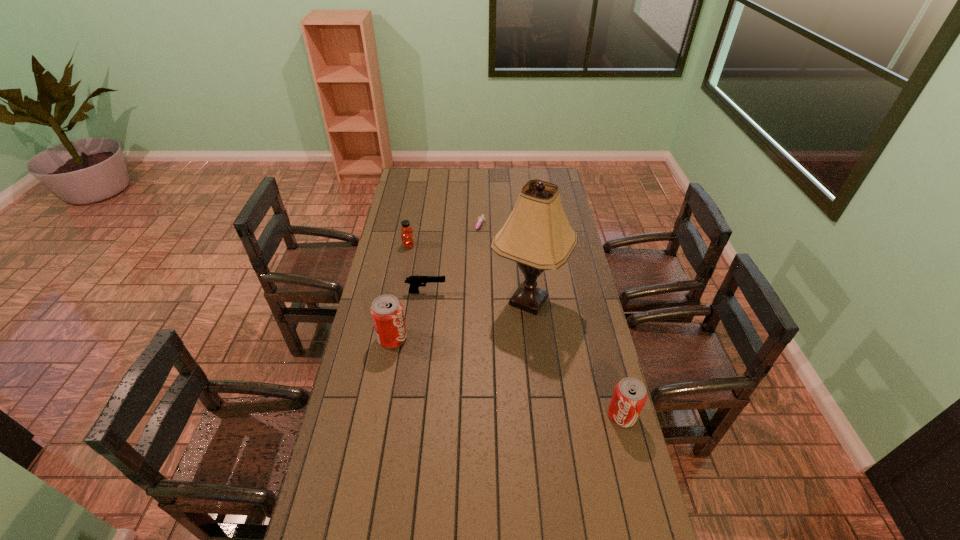
The image size is (960, 540). I want to click on free space that satisfies the following two spatial constraints: 1. on the front side of the nearer soda can; 2. on the right side of the farther soda can, so click(378, 415).

Where is `free space in the image that satisfies the following two spatial constraints: 1. on the front label of the tallest object; 2. on the left side of the honey`? free space in the image that satisfies the following two spatial constraints: 1. on the front label of the tallest object; 2. on the left side of the honey is located at coordinates (398, 301).

Locate an element on the screen. The image size is (960, 540). free space that satisfies the following two spatial constraints: 1. on the front-facing side of the pistol; 2. on the left side of the fifth object from left to right is located at coordinates (425, 301).

You are a GUI agent. You are given a task and a screenshot of the screen. Output one action in this format:
    pyautogui.click(x=<x>, y=<y>)
    Task: Click on the blank space that satisfies the following two spatial constraints: 1. on the front-facing side of the shorter soda can; 2. on the left side of the pistol
    
    Given the screenshot: What is the action you would take?
    pyautogui.click(x=411, y=415)

What are the coordinates of `vacant space that satisfies the following two spatial constraints: 1. on the front-facing side of the pistol; 2. on the right side of the shorter soda can` in the screenshot? It's located at (411, 415).

Identify the location of vacant region that satisfies the following two spatial constraints: 1. on the back side of the tallest object; 2. on the right side of the farther soda can. (399, 301).

I want to click on free space that satisfies the following two spatial constraints: 1. on the back side of the right soda can; 2. on the front-facing side of the fifth tallest object, so click(x=590, y=292).